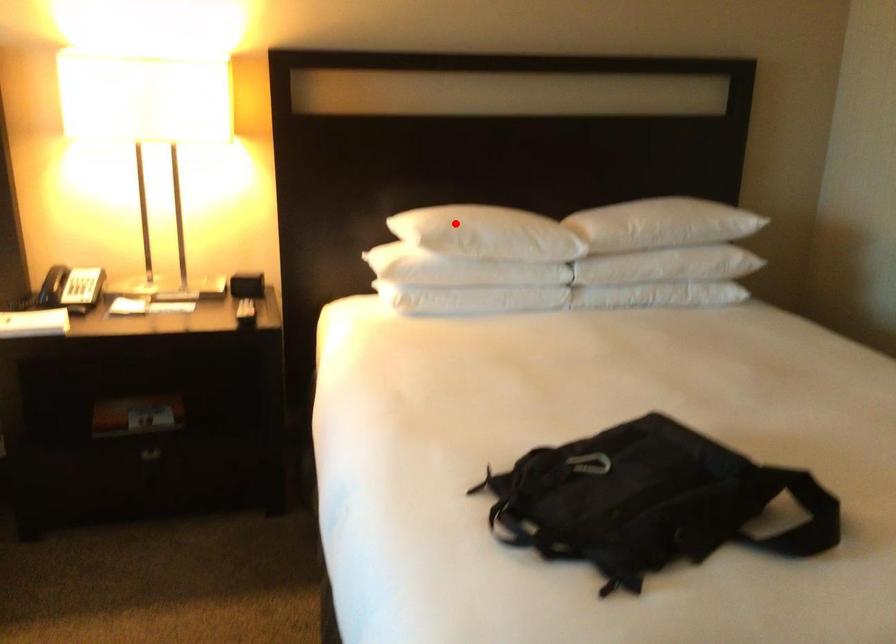
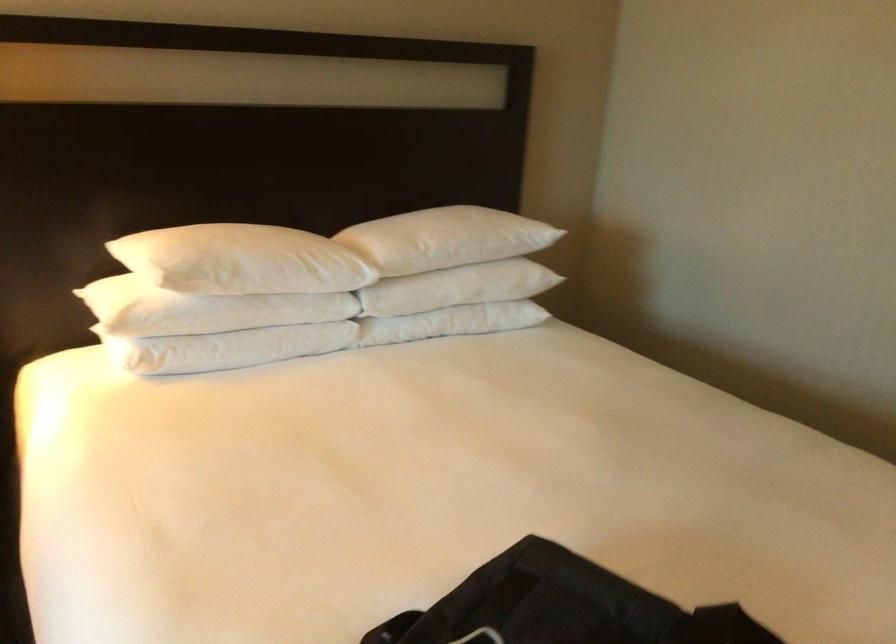
Question: I am providing you with two images of the same scene from different viewpoints. A red point is shown in image1. For the corresponding object point in image2, is it positioned nearer or farther from the camera?

Choices:
 (A) Nearer
 (B) Farther

Answer: (A)